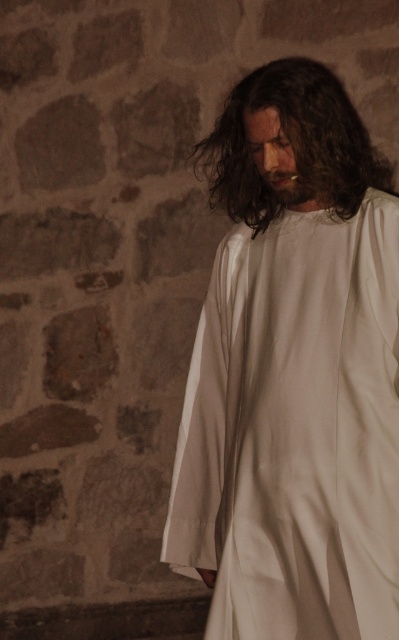
Between white cloth at center and dark brown silky hair at center, which one appears on the left side from the viewer's perspective?

From the viewer's perspective, dark brown silky hair at center appears more on the left side.

Does white cloth at center have a lesser height compared to dark brown silky hair at center?

In fact, white cloth at center may be taller than dark brown silky hair at center.

Which is behind, point (227, 509) or point (276, 195)?

Positioned behind is point (276, 195).

You are a GUI agent. You are given a task and a screenshot of the screen. Output one action in this format:
    pyautogui.click(x=<x>, y=<y>)
    Task: Click on the white cloth at center
    This screenshot has width=399, height=640.
    Given the screenshot: What is the action you would take?
    click(294, 372)